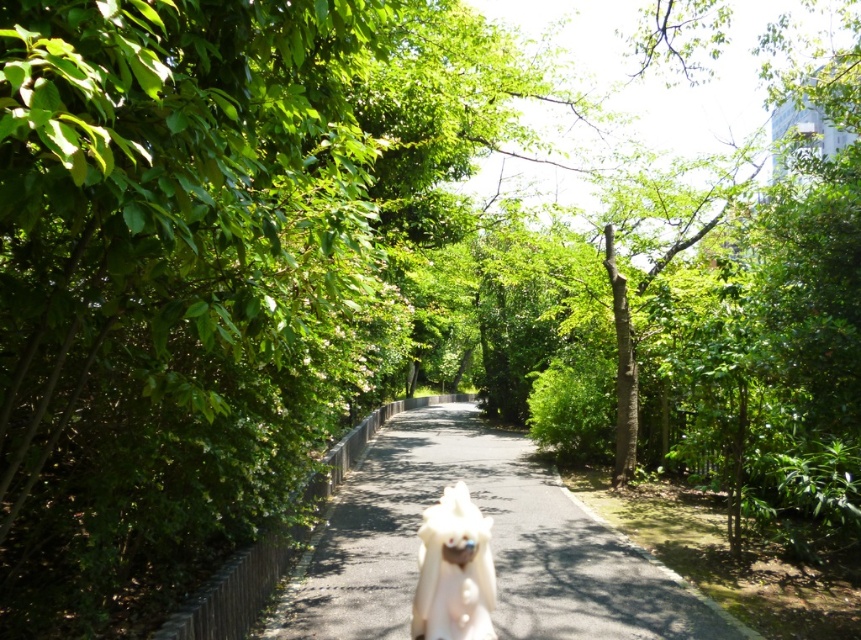
The height and width of the screenshot is (640, 861). Describe the element at coordinates (488, 545) in the screenshot. I see `white fabric dog at center` at that location.

Image resolution: width=861 pixels, height=640 pixels. I want to click on white fabric dog at center, so click(x=488, y=545).

What are the coordinates of `white fabric dog at center` in the screenshot? It's located at (488, 545).

This screenshot has width=861, height=640. I want to click on white fabric dog at center, so click(488, 545).